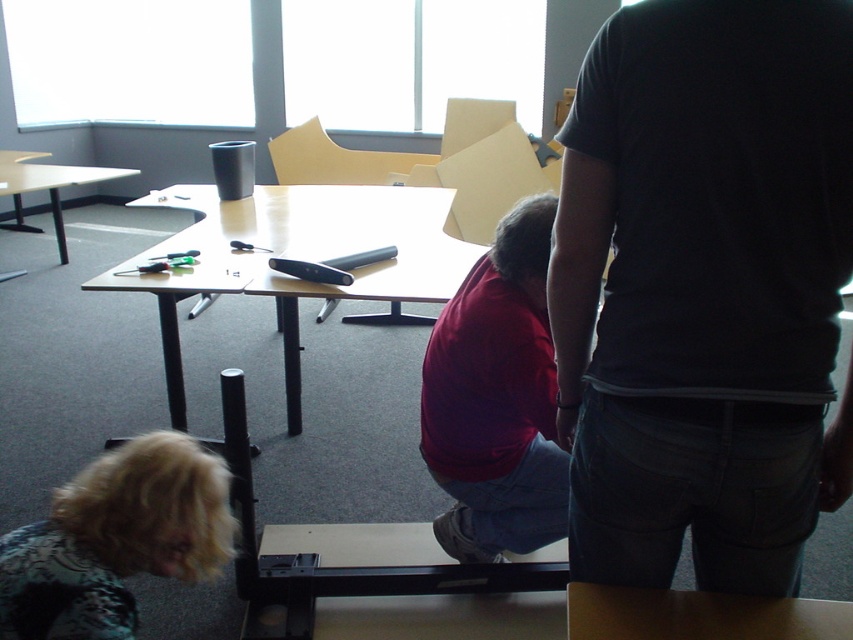
Question: Estimate the real-world distances between objects in this image. Which object is farther from the wooden table at center?

Choices:
 (A) dark gray t-shirt at center
 (B) fluffy teal sweater at lower left

Answer: (B)

Question: Does black metal table at lower center have a larger size compared to brown wooden table at lower center?

Choices:
 (A) no
 (B) yes

Answer: (B)

Question: Where is dark gray t-shirt at center located in relation to matte black table at left in the image?

Choices:
 (A) above
 (B) below

Answer: (B)

Question: Considering the real-world distances, which object is closest to the brown wooden table at lower center?

Choices:
 (A) wooden table at center
 (B) dark gray t-shirt at center

Answer: (B)

Question: Does fluffy teal sweater at lower left lie in front of brown wooden table at lower center?

Choices:
 (A) yes
 (B) no

Answer: (B)

Question: Which point appears farthest from the camera in this image?

Choices:
 (A) [x=772, y=192]
 (B) [x=13, y=163]
 (C) [x=50, y=621]

Answer: (B)